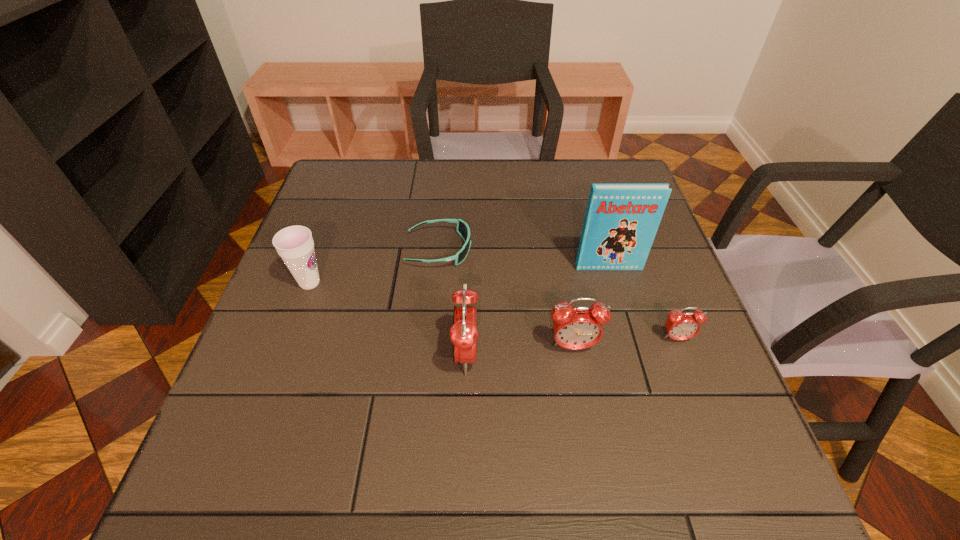
Please point a free position for a alarm clock on the left. Please provide its 2D coordinates. Your answer should be formatted as a tuple, i.e. [(x, y)], where the tuple contains the x and y coordinates of a point satisfying the conditions above.

[(356, 364)]